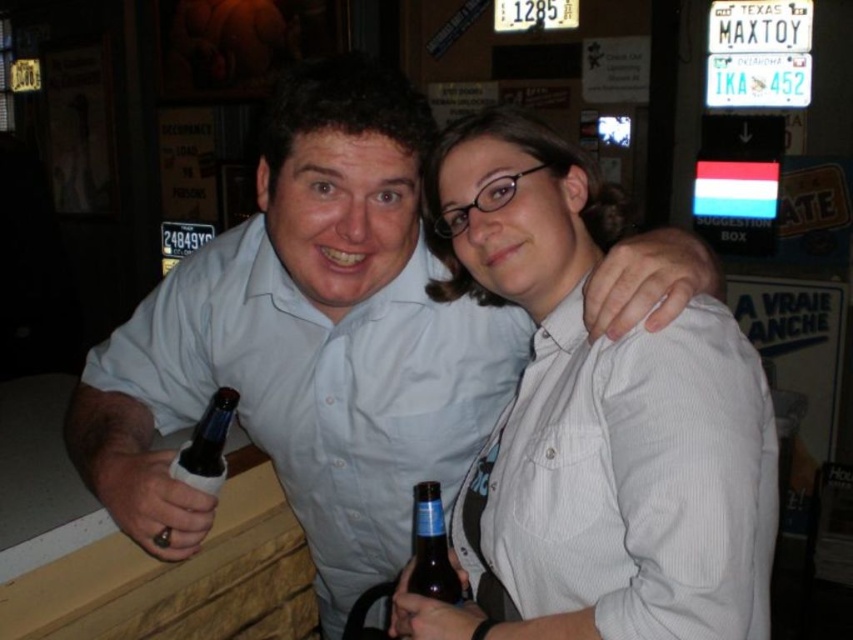
Can you confirm if brown glass bottle at center is thinner than dark glass bottle at lower left?

Indeed, brown glass bottle at center has a lesser width compared to dark glass bottle at lower left.

Between point (416, 518) and point (198, 484), which one is positioned in front?

Positioned in front is point (198, 484).

The height and width of the screenshot is (640, 853). What do you see at coordinates (431, 547) in the screenshot? I see `brown glass bottle at center` at bounding box center [431, 547].

You are a GUI agent. You are given a task and a screenshot of the screen. Output one action in this format:
    pyautogui.click(x=<x>, y=<y>)
    Task: Click on the brown glass bottle at center
    This screenshot has width=853, height=640.
    Given the screenshot: What is the action you would take?
    pyautogui.click(x=431, y=547)

Does matte light blue shirt at center appear under dark glass bottle at lower left?

Correct, matte light blue shirt at center is located below dark glass bottle at lower left.

Is matte light blue shirt at center shorter than dark glass bottle at lower left?

No, matte light blue shirt at center is not shorter than dark glass bottle at lower left.

Does point (325, 593) come in front of point (193, 474)?

No, (325, 593) is further to viewer.

Identify the location of matte light blue shirt at center. This screenshot has width=853, height=640. (308, 342).

Does matte light blue shirt at center appear on the right side of white textured shirt at center?

No, matte light blue shirt at center is not to the right of white textured shirt at center.

The height and width of the screenshot is (640, 853). What do you see at coordinates (308, 342) in the screenshot? I see `matte light blue shirt at center` at bounding box center [308, 342].

What are the coordinates of `matte light blue shirt at center` in the screenshot? It's located at (308, 342).